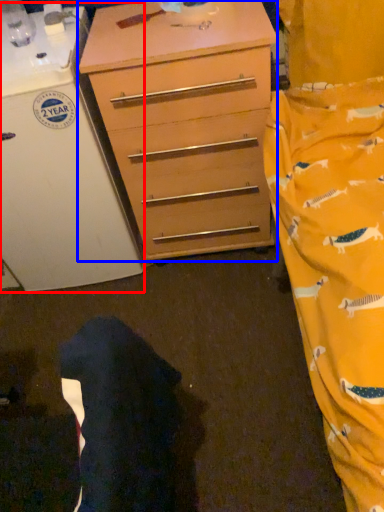
Question: Which object is further to the camera taking this photo, appliance (highlighted by a red box) or chest of drawers (highlighted by a blue box)?

Choices:
 (A) appliance
 (B) chest of drawers

Answer: (B)